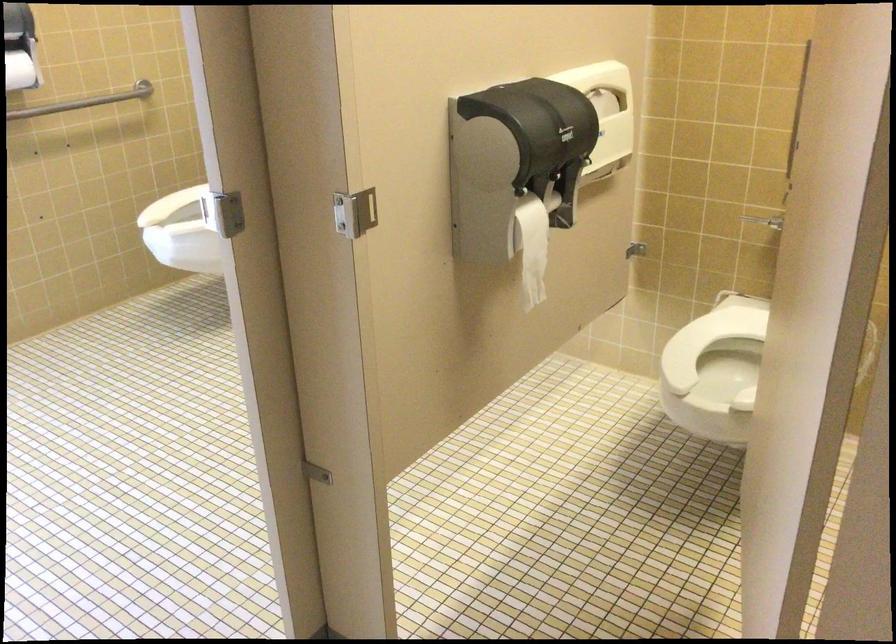
Where would you lift the white toilet lid? Please return your answer as a coordinate pair (x, y).

(711, 339)